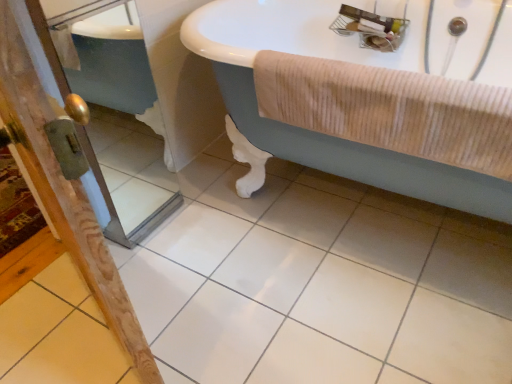
You are a GUI agent. You are given a task and a screenshot of the screen. Output one action in this format:
    pyautogui.click(x=<x>, y=<y>)
    Task: Click on the wooden screen door at lower left, placed as the first screen door when sorted from right to left
    Image resolution: width=512 pixels, height=384 pixels.
    Given the screenshot: What is the action you would take?
    pyautogui.click(x=106, y=60)

The width and height of the screenshot is (512, 384). Describe the element at coordinates (316, 132) in the screenshot. I see `white glossy bathtub at upper center` at that location.

Describe the element at coordinates (390, 109) in the screenshot. I see `beige corduroy towel at right` at that location.

At what (x,y) coordinates should I click in order to perform the action: click on wooden screen door at left, the second screen door viewed from the right. Please return your answer as a coordinate pair (x, y). Looking at the image, I should click on (65, 194).

Measure the distance from wooden screen door at left, the first screen door positioned from the left, to white glossy tile at center.

wooden screen door at left, the first screen door positioned from the left, and white glossy tile at center are 28.37 inches apart.

What are the coordinates of `the 2nd screen door behind the white glossy tile at center` in the screenshot? It's located at (65, 194).

From a real-world perspective, which object stands above the other?

wooden screen door at left, the second screen door viewed from the right, is physically above.

Is wooden screen door at left, the second screen door viewed from the right, directly adjacent to white glossy tile at center?

wooden screen door at left, the second screen door viewed from the right, and white glossy tile at center are clearly separated.

Is white glossy tile at center bigger than white glossy bathtub at upper center?

No, white glossy tile at center is not bigger than white glossy bathtub at upper center.

Is white glossy tile at center outside of white glossy bathtub at upper center?

white glossy tile at center lies outside white glossy bathtub at upper center's area.

Is white glossy tile at center thinner than white glossy bathtub at upper center?

In fact, white glossy tile at center might be wider than white glossy bathtub at upper center.

From the picture: From a real-world perspective, who is located lower, white glossy tile at center or wooden screen door at lower left, the second screen door from the left?

From a 3D spatial view, white glossy tile at center is below.

I want to click on ceramic tile below the wooden screen door at lower left, the second screen door from the left (from the image's perspective), so click(319, 283).

Is white glossy tile at center facing towards wooden screen door at lower left, the second screen door from the left?

No.

Is white glossy tile at center completely or partially outside of wooden screen door at lower left, the second screen door from the left?

Yes, white glossy tile at center is outside of wooden screen door at lower left, the second screen door from the left.

Is beige corduroy towel at right inside white glossy tile at center?

No, beige corduroy towel at right is not surrounded by white glossy tile at center.

Which is more to the left, white glossy tile at center or beige corduroy towel at right?

From the viewer's perspective, white glossy tile at center appears more on the left side.

In terms of height, does white glossy tile at center look taller or shorter compared to beige corduroy towel at right?

Considering their sizes, white glossy tile at center has less height than beige corduroy towel at right.

Locate an element on the screen. The image size is (512, 384). bath towel above the white glossy tile at center (from the image's perspective) is located at coordinates (390, 109).

Looking at this image, does beige corduroy towel at right have a larger size compared to white glossy tile at center?

No, beige corduroy towel at right is not bigger than white glossy tile at center.

Is point (327, 118) positioned in front of point (432, 321)?

Yes.

From a real-world perspective, is beige corduroy towel at right below white glossy tile at center?

No, from a real-world perspective, beige corduroy towel at right is not beneath white glossy tile at center.

Is beige corduroy towel at right directly adjacent to white glossy tile at center?

No, beige corduroy towel at right is not with white glossy tile at center.

From the image's perspective, is wooden screen door at lower left, the second screen door from the left, located above wooden screen door at left, the second screen door viewed from the right?

Yes, from the image's perspective, wooden screen door at lower left, the second screen door from the left, is on top of wooden screen door at left, the second screen door viewed from the right.

Can you confirm if wooden screen door at lower left, the second screen door from the left, is smaller than wooden screen door at left, the second screen door viewed from the right?

Incorrect, wooden screen door at lower left, the second screen door from the left, is not smaller in size than wooden screen door at left, the second screen door viewed from the right.

From the picture: Visually, is wooden screen door at lower left, the second screen door from the left, positioned to the left or to the right of wooden screen door at left, the second screen door viewed from the right?

Clearly, wooden screen door at lower left, the second screen door from the left, is on the right of wooden screen door at left, the second screen door viewed from the right, in the image.

Considering their positions, is wooden screen door at lower left, the second screen door from the left, located in front of or behind wooden screen door at left, the second screen door viewed from the right?

wooden screen door at lower left, the second screen door from the left, is in front of wooden screen door at left, the second screen door viewed from the right.

Is wooden screen door at lower left, the second screen door from the left, placed right next to white glossy bathtub at upper center?

They are not placed beside each other.

Consider the image. From a real-world perspective, between wooden screen door at lower left, placed as the first screen door when sorted from right to left, and white glossy bathtub at upper center, who is vertically lower?

From a 3D spatial view, white glossy bathtub at upper center is below.

Locate an element on the screen. This screenshot has width=512, height=384. bathtub that is on the right side of wooden screen door at lower left, the second screen door from the left is located at coordinates (316, 132).

From the image's perspective, does wooden screen door at lower left, placed as the first screen door when sorted from right to left, appear higher than white glossy bathtub at upper center?

No, from the image's perspective, wooden screen door at lower left, placed as the first screen door when sorted from right to left, is not on top of white glossy bathtub at upper center.

You are a GUI agent. You are given a task and a screenshot of the screen. Output one action in this format:
    pyautogui.click(x=<x>, y=<y>)
    Task: Click on the ceramic tile on the right of wooden screen door at left, the second screen door viewed from the right
    Image resolution: width=512 pixels, height=384 pixels.
    Given the screenshot: What is the action you would take?
    pyautogui.click(x=319, y=283)

There is a white glossy tile at center. Where is `bathtub above it (from a real-world perspective)`? The width and height of the screenshot is (512, 384). bathtub above it (from a real-world perspective) is located at coordinates (316, 132).

Based on their spatial positions, is wooden screen door at left, the second screen door viewed from the right, or white glossy tile at center closer to beige corduroy towel at right?

white glossy tile at center is positioned closer to the anchor beige corduroy towel at right.

Estimate the real-world distances between objects in this image. Which object is closer to wooden screen door at left, the second screen door viewed from the right, white glossy tile at center or beige corduroy towel at right?

beige corduroy towel at right lies closer to wooden screen door at left, the second screen door viewed from the right, than the other object.

Considering their positions, is wooden screen door at lower left, placed as the first screen door when sorted from right to left, positioned closer to beige corduroy towel at right than white glossy tile at center?

The object closer to beige corduroy towel at right is white glossy tile at center.

Considering their positions, is white glossy tile at center positioned closer to beige corduroy towel at right than white glossy bathtub at upper center?

Based on the image, white glossy bathtub at upper center appears to be nearer to beige corduroy towel at right.

When comparing their distances from white glossy tile at center, does wooden screen door at lower left, placed as the first screen door when sorted from right to left, or wooden screen door at left, the second screen door viewed from the right, seem closer?

The object closer to white glossy tile at center is wooden screen door at lower left, placed as the first screen door when sorted from right to left.

Which object lies nearer to the anchor point white glossy bathtub at upper center, wooden screen door at lower left, the second screen door from the left, or beige corduroy towel at right?

beige corduroy towel at right is closer to white glossy bathtub at upper center.

Estimate the real-world distances between objects in this image. Which object is further from wooden screen door at left, the first screen door positioned from the left, beige corduroy towel at right or white glossy bathtub at upper center?

white glossy bathtub at upper center is further to wooden screen door at left, the first screen door positioned from the left.

Based on their spatial positions, is wooden screen door at left, the first screen door positioned from the left, or beige corduroy towel at right closer to white glossy tile at center?

beige corduroy towel at right.

Where is `ceramic tile located between wooden screen door at left, the first screen door positioned from the left, and beige corduroy towel at right in the left-right direction`? ceramic tile located between wooden screen door at left, the first screen door positioned from the left, and beige corduroy towel at right in the left-right direction is located at coordinates (319, 283).

Locate an element on the screen. Image resolution: width=512 pixels, height=384 pixels. ceramic tile situated between wooden screen door at left, the first screen door positioned from the left, and white glossy bathtub at upper center from left to right is located at coordinates (319, 283).

Where is `ceramic tile between wooden screen door at lower left, placed as the first screen door when sorted from right to left, and beige corduroy towel at right from left to right`? The width and height of the screenshot is (512, 384). ceramic tile between wooden screen door at lower left, placed as the first screen door when sorted from right to left, and beige corduroy towel at right from left to right is located at coordinates (319, 283).

Locate an element on the screen. The width and height of the screenshot is (512, 384). ceramic tile situated between wooden screen door at lower left, placed as the first screen door when sorted from right to left, and white glossy bathtub at upper center from left to right is located at coordinates (319, 283).